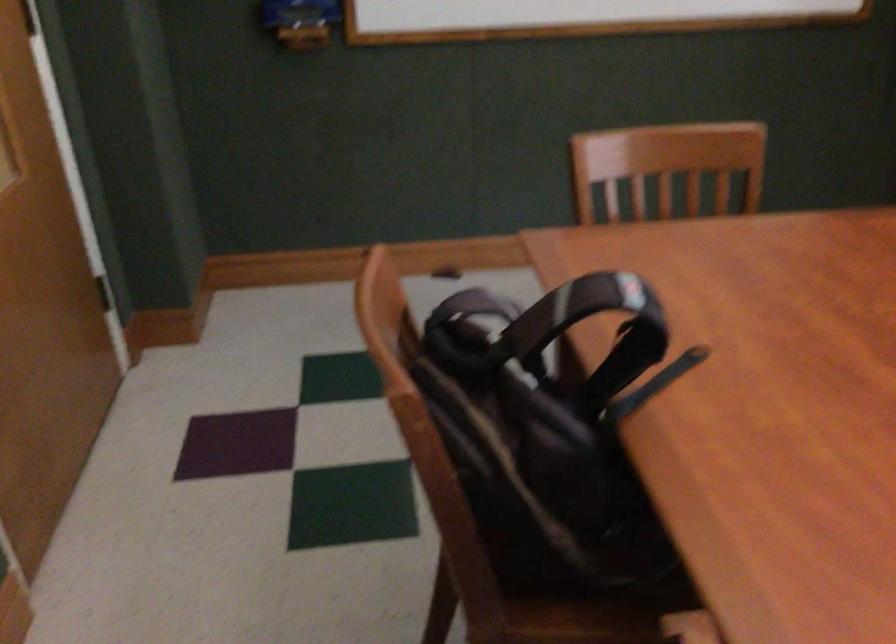
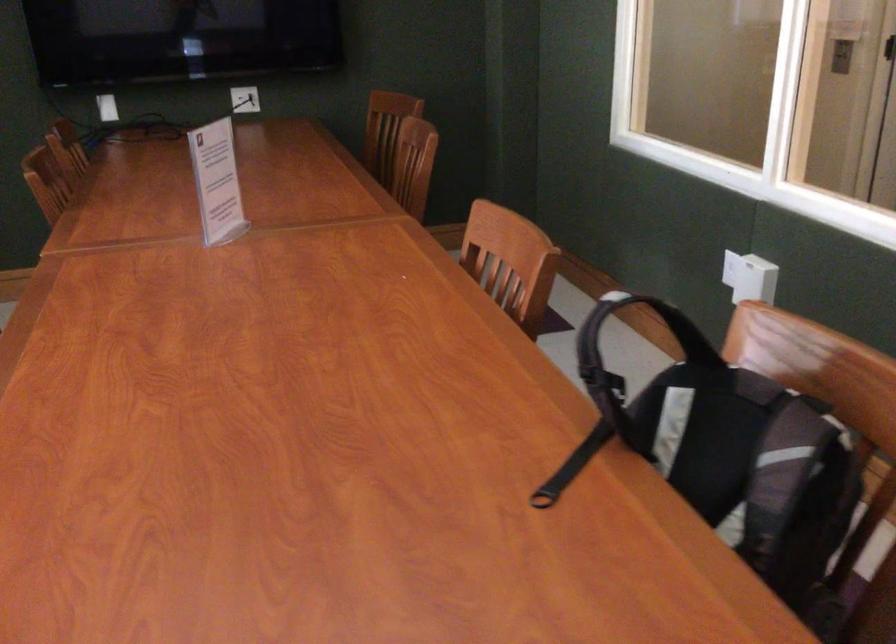
Where in the second image is the point corresponding to (x=659, y=372) from the first image?

(572, 466)